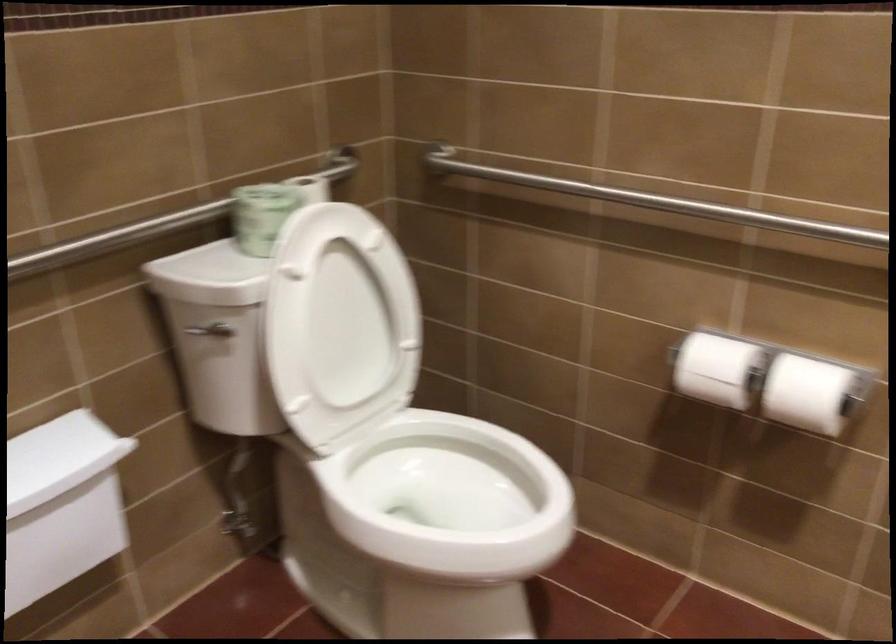
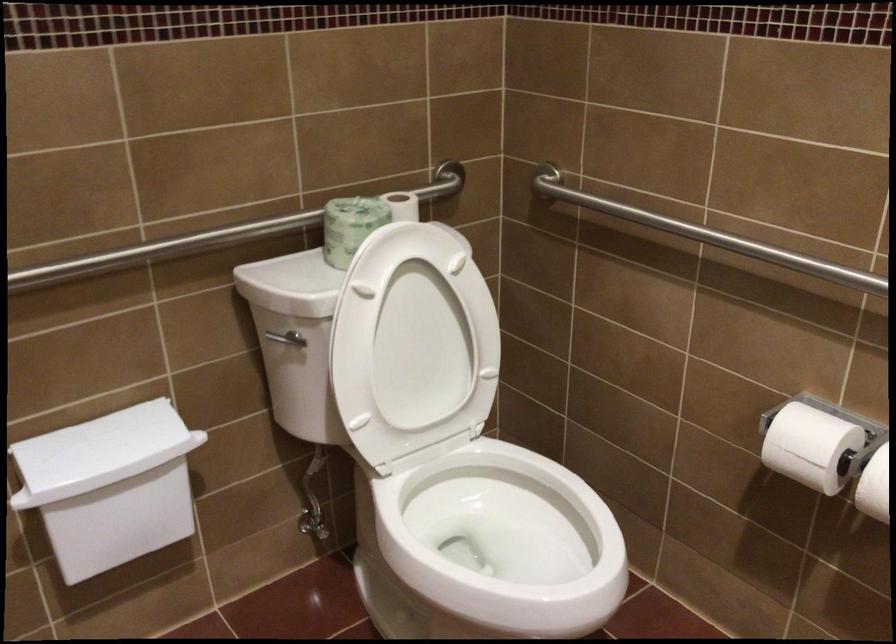
Find the pixel in the second image that matches (x=440, y=507) in the first image.

(497, 544)